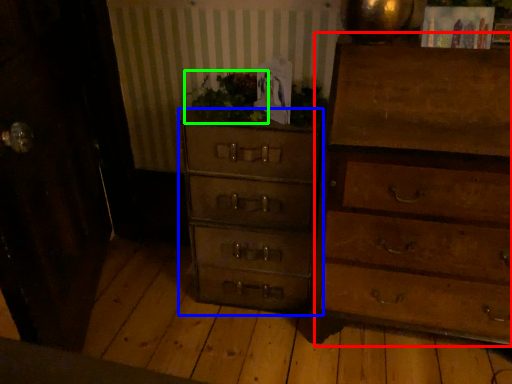
Question: Based on their relative distances, which object is nearer to chest of drawers (highlighted by a red box)? Choose from chest of drawers (highlighted by a blue box) and houseplant (highlighted by a green box).

Choices:
 (A) chest of drawers
 (B) houseplant

Answer: (A)